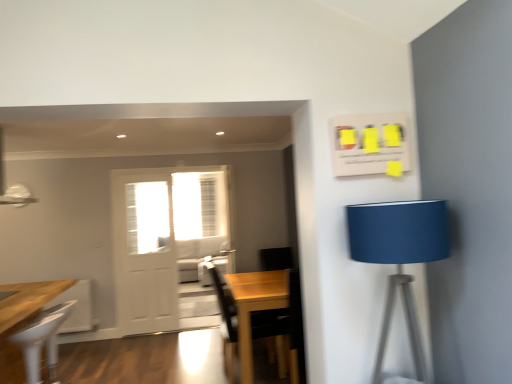
Question: Considering the relative sizes of blue fabric lampshade at right and white sheer curtain at center in the image provided, is blue fabric lampshade at right wider than white sheer curtain at center?

Choices:
 (A) yes
 (B) no

Answer: (A)

Question: Is blue fabric lampshade at right looking in the opposite direction of white sheer curtain at center?

Choices:
 (A) no
 (B) yes

Answer: (B)

Question: Would you say blue fabric lampshade at right is outside white sheer curtain at center?

Choices:
 (A) yes
 (B) no

Answer: (A)

Question: Considering the relative sizes of blue fabric lampshade at right and white sheer curtain at center in the image provided, is blue fabric lampshade at right taller than white sheer curtain at center?

Choices:
 (A) no
 (B) yes

Answer: (A)

Question: Is blue fabric lampshade at right thinner than white sheer curtain at center?

Choices:
 (A) yes
 (B) no

Answer: (B)

Question: In the image, is blue fabric lampshade at right positioned in front of or behind white plastic chair at lower left?

Choices:
 (A) behind
 (B) front

Answer: (B)

Question: Looking at the image, does blue fabric lampshade at right seem bigger or smaller compared to white plastic chair at lower left?

Choices:
 (A) small
 (B) big

Answer: (B)

Question: Is blue fabric lampshade at right to the left or to the right of white plastic chair at lower left in the image?

Choices:
 (A) right
 (B) left

Answer: (A)

Question: From the image's perspective, relative to white plastic chair at lower left, is blue fabric lampshade at right above or below?

Choices:
 (A) below
 (B) above

Answer: (B)

Question: Is blue fabric lampshade at right taller or shorter than light gray fabric couch at center?

Choices:
 (A) tall
 (B) short

Answer: (A)

Question: Is blue fabric lampshade at right wider or thinner than light gray fabric couch at center?

Choices:
 (A) thin
 (B) wide

Answer: (A)

Question: In the image, is blue fabric lampshade at right on the left side or the right side of light gray fabric couch at center?

Choices:
 (A) left
 (B) right

Answer: (B)

Question: From the image's perspective, is blue fabric lampshade at right above or below light gray fabric couch at center?

Choices:
 (A) below
 (B) above

Answer: (B)

Question: In the image, is white sheer curtain at center positioned in front of or behind blue fabric lampshade at right?

Choices:
 (A) behind
 (B) front

Answer: (A)

Question: Considering the positions of white sheer curtain at center and blue fabric lampshade at right in the image, is white sheer curtain at center taller or shorter than blue fabric lampshade at right?

Choices:
 (A) tall
 (B) short

Answer: (A)